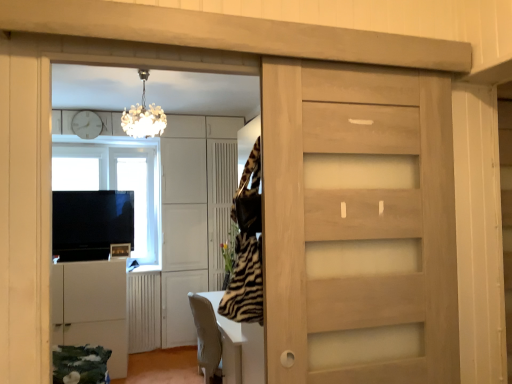
Question: Considering their positions, is matte white cabinet at left located in front of or behind white glossy table at center?

Choices:
 (A) front
 (B) behind

Answer: (A)

Question: Is matte white cabinet at left inside or outside of white glossy table at center?

Choices:
 (A) inside
 (B) outside

Answer: (B)

Question: Estimate the real-world distances between objects in this image. Which object is farther from the white matte cabinet at lower left?

Choices:
 (A) flat screen tv at left, which is counted as the 1th appliance, starting from the top
 (B) transparent glass window at upper left
 (C) white glossy table at center
 (D) metallic silver toaster at lower left, marked as the first appliance in a bottom-to-top arrangement
 (E) matte white cabinet at left

Answer: (C)

Question: Estimate the real-world distances between objects in this image. Which object is farther from the white glossy table at center?

Choices:
 (A) metallic silver toaster at lower left, marked as the first appliance in a bottom-to-top arrangement
 (B) white matte cabinet at lower left
 (C) transparent glass window at upper left
 (D) matte white cabinet at left
 (E) white wooden clock at upper center

Answer: (E)